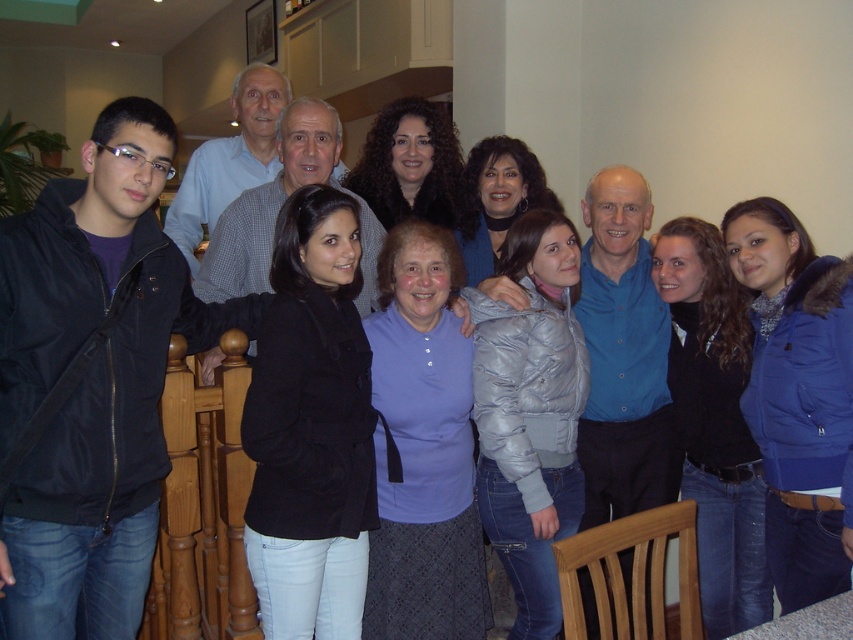
Question: Is silver puffy jacket at center smaller than dark blue puffy jacket at center?

Choices:
 (A) yes
 (B) no

Answer: (B)

Question: Among these objects, which one is farthest from the camera?

Choices:
 (A) blue puffy jacket at lower right
 (B) purple fabric shirt at center
 (C) shiny silver jacket at center

Answer: (C)

Question: Which of the following is the closest to the observer?

Choices:
 (A) curly brown hair at center
 (B) purple fabric shirt at center

Answer: (B)

Question: Estimate the real-world distances between objects in this image. Which object is farther from the purple fabric shirt at center?

Choices:
 (A) black matte jacket at center
 (B) silver puffy jacket at center
 (C) curly brown hair at center
 (D) blue puffy jacket at lower right

Answer: (C)

Question: Is black matte jacket at center smaller than dark blue puffy jacket at center?

Choices:
 (A) no
 (B) yes

Answer: (B)

Question: Can you confirm if black matte jacket at center is thinner than silver puffy jacket at center?

Choices:
 (A) no
 (B) yes

Answer: (B)